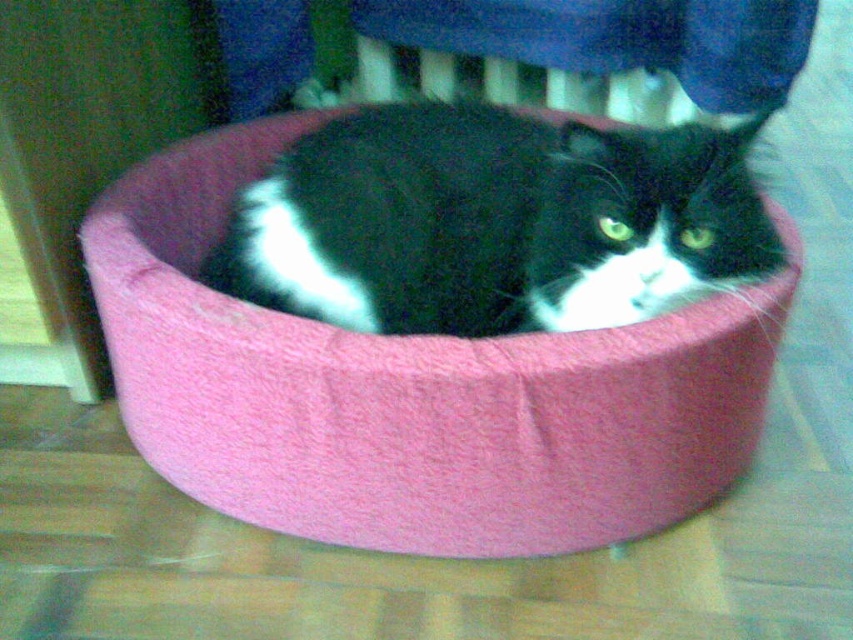
Looking at this image, you are a photographer setting up a shot of the black and white cat in the pink plush cat bed. You need to position your camera exactly at the point marked as point [410,392]. Where should you place your camera to capture the cat in the pink plush cat bed?

The point [410,392] indicates the location of the pink plush cat bed at center, so placing the camera at that point would position it directly at the center of the bed where the cat is resting.

You are a photographer setting up a shoot in the room where the pink plush cat bed at center and the black fuzzy cat at center are located. You want to ensure that the cat bed is fully visible in the photo without any obstruction from the cat. Based on their positions, can you confirm if the cat is currently blocking the view of the bed?

The pink plush cat bed at center is in front of the black fuzzy cat at center, meaning the bed is closer to the camera and the cat is behind it. Therefore, the cat is not blocking the view of the bed, as the bed is positioned in front of the cat.

You are standing in the room and want to place a small toy between the two points, point (425, 358) and point (573, 172). Which point should the toy be closer to so it appears larger to you?

The toy should be placed closer to point (425, 358) because it is closer to the viewer than point (573, 172), making the toy appear larger when positioned nearer to the viewer.